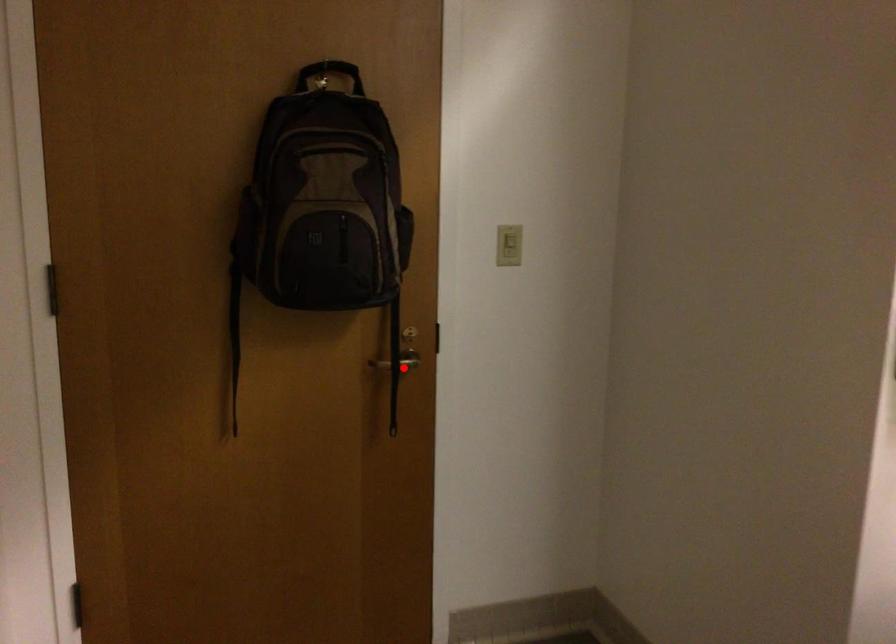
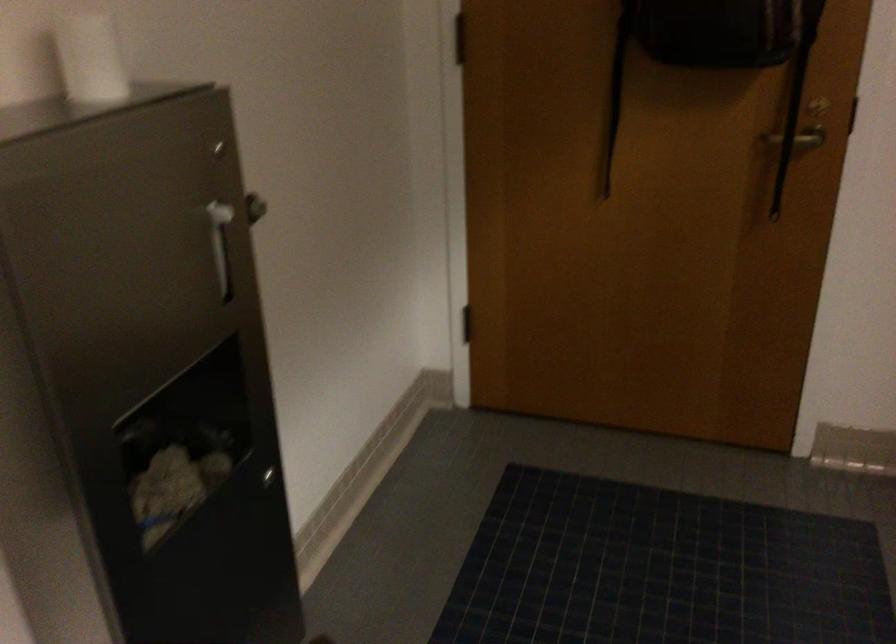
In the second image, find the point that corresponds to the highlighted location in the first image.

(798, 138)